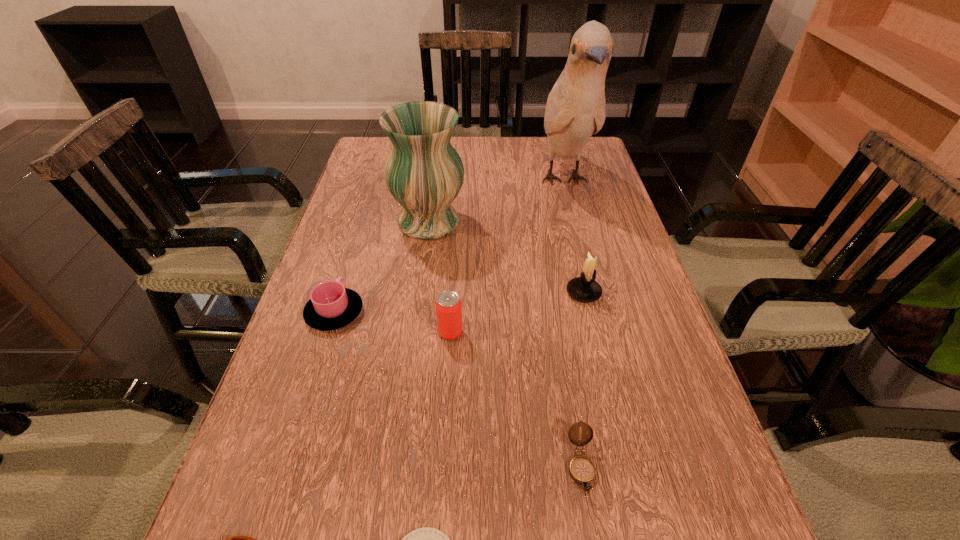
You are a GUI agent. You are given a task and a screenshot of the screen. Output one action in this format:
    pyautogui.click(x=<x>, y=<y>)
    Task: Click on the vacant space located 0.190m on the front of the beer can
    This screenshot has width=960, height=540.
    Given the screenshot: What is the action you would take?
    pyautogui.click(x=444, y=435)

Image resolution: width=960 pixels, height=540 pixels. Find the location of `vacant region located on the side with the handle of the cup`. vacant region located on the side with the handle of the cup is located at coordinates (362, 225).

Where is `vacant area situated 0.220m on the side with the handle of the cup`? Image resolution: width=960 pixels, height=540 pixels. vacant area situated 0.220m on the side with the handle of the cup is located at coordinates (361, 230).

This screenshot has height=540, width=960. Identify the location of vacant region located 0.200m on the side with the handle of the cup. (359, 234).

This screenshot has height=540, width=960. In order to click on vacant space located 0.050m on the face of the sixth farthest object in this screenshot , I will do `click(592, 537)`.

Identify the location of object that is at the far edge. Image resolution: width=960 pixels, height=540 pixels. (575, 110).

The width and height of the screenshot is (960, 540). I want to click on vase present at the left edge, so click(x=424, y=173).

Locate an element on the screen. Image resolution: width=960 pixels, height=540 pixels. cup that is at the left edge is located at coordinates (331, 306).

At what (x,y) coordinates should I click in order to perform the action: click on parakeet that is at the right edge. Please return your answer as a coordinate pair (x, y). This screenshot has width=960, height=540. Looking at the image, I should click on (575, 110).

Find the location of a particular element. This screenshot has width=960, height=540. candle holder at the right edge is located at coordinates (584, 288).